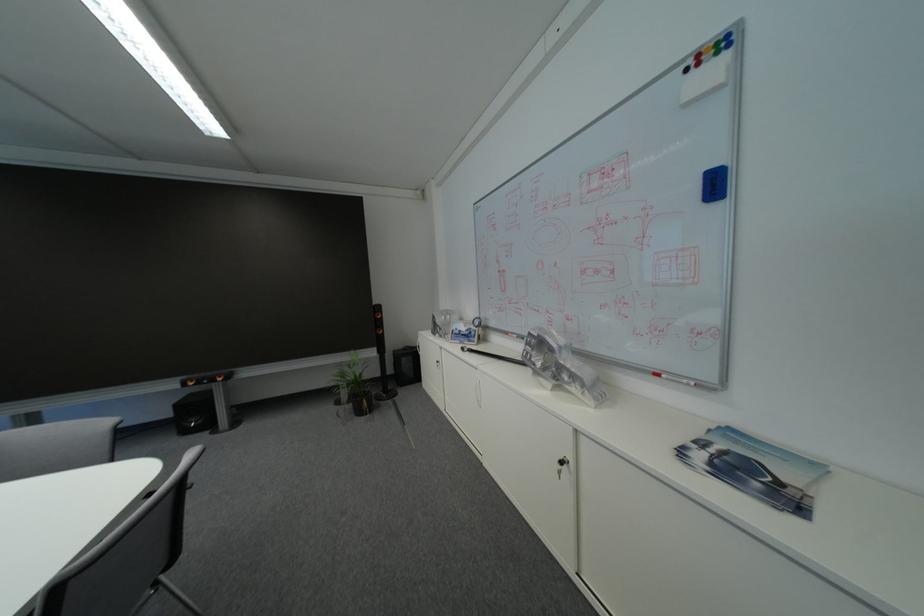
You are a GUI agent. You are given a task and a screenshot of the screen. Output one action in this format:
    pyautogui.click(x=<x>, y=<y>)
    Task: Click on the metal part in plastic
    The height and width of the screenshot is (616, 924).
    Given the screenshot: What is the action you would take?
    pyautogui.click(x=562, y=366)